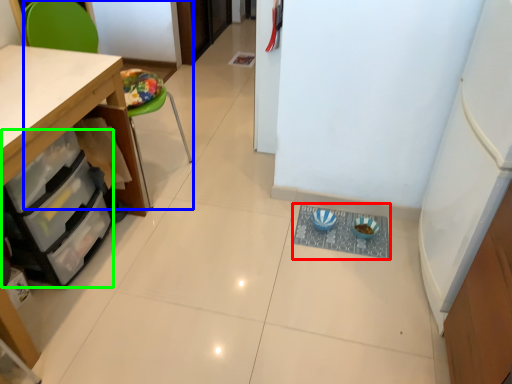
Question: Based on their relative distances, which object is farther from wide (highlighted by a red box)? Choose from chair (highlighted by a blue box) and drawer (highlighted by a green box).

Choices:
 (A) chair
 (B) drawer

Answer: (A)